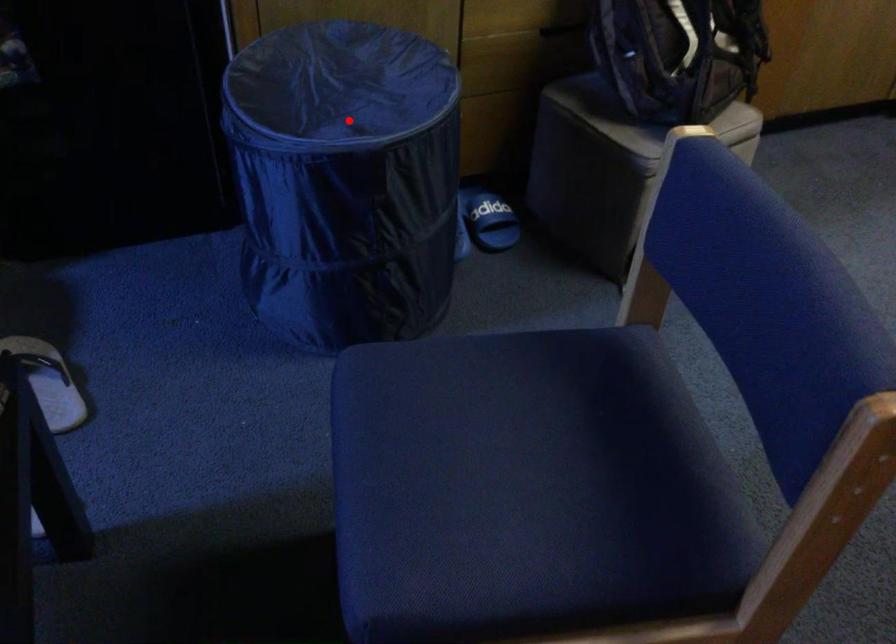
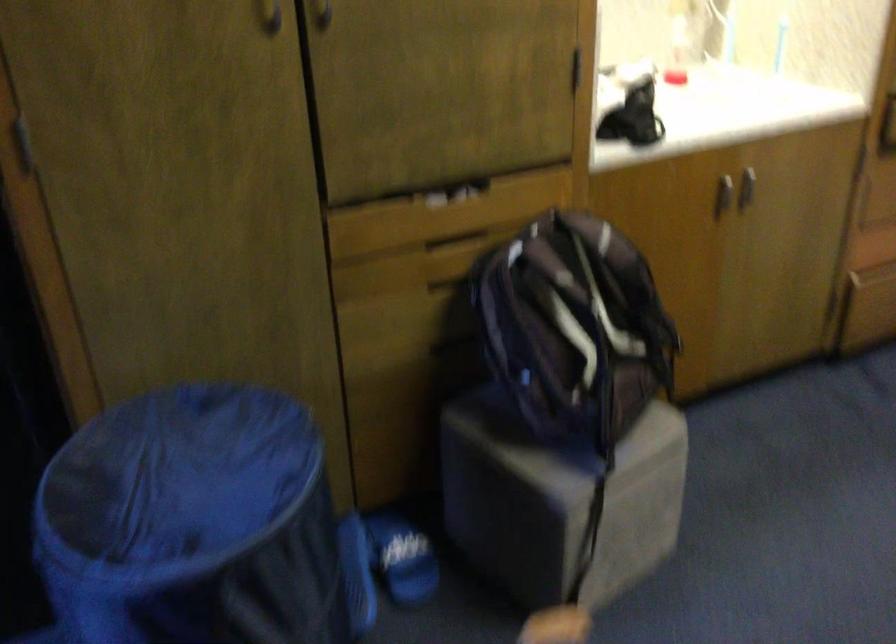
Question: I am providing you with two images of the same scene from different viewpoints. A red point is marked on the first image. At the location where the point appears in image 1, is it still visible in image 2?

Choices:
 (A) Yes
 (B) No

Answer: (A)